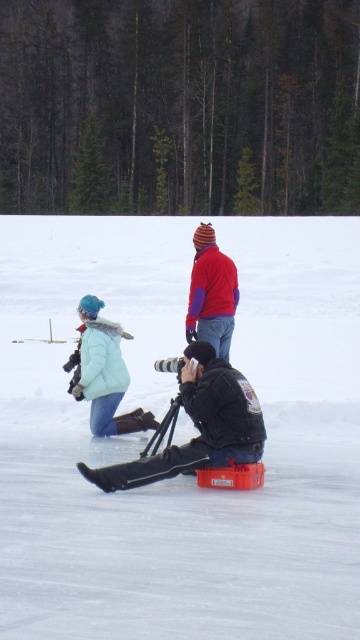
Question: Is orange plastic container at center thinner than matte teal jacket at lower left?

Choices:
 (A) yes
 (B) no

Answer: (B)

Question: Does dark blue leather jacket at lower center appear on the right side of black matte tripod at center?

Choices:
 (A) no
 (B) yes

Answer: (A)

Question: Which of these objects is positioned farthest from the matte teal jacket at lower left?

Choices:
 (A) black matte tripod at center
 (B) dark blue leather jacket at lower center
 (C) orange plastic container at center
 (D) red woolen hat at upper center

Answer: (C)

Question: Which of the following is the closest to the observer?

Choices:
 (A) matte teal jacket at lower left
 (B) orange plastic container at center
 (C) dark blue leather jacket at lower center

Answer: (B)

Question: Is orange plastic container at center closer to camera compared to matte teal jacket at lower left?

Choices:
 (A) no
 (B) yes

Answer: (B)

Question: Which of the following is the closest to the observer?

Choices:
 (A) dark blue leather jacket at lower center
 (B) black matte tripod at center
 (C) matte teal jacket at lower left

Answer: (A)